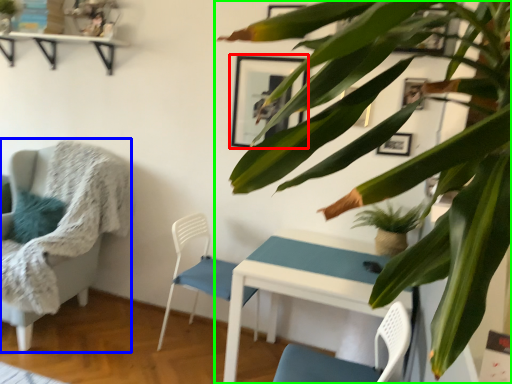
Question: Based on their relative distances, which object is farther from picture frame (highlighted by a red box)? Choose from chair (highlighted by a blue box) and houseplant (highlighted by a green box).

Choices:
 (A) chair
 (B) houseplant

Answer: (B)